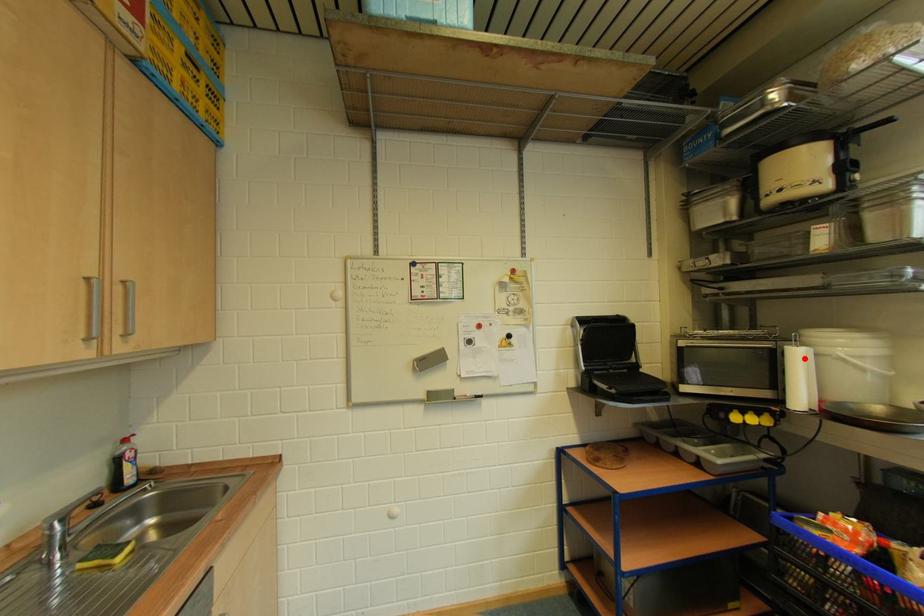
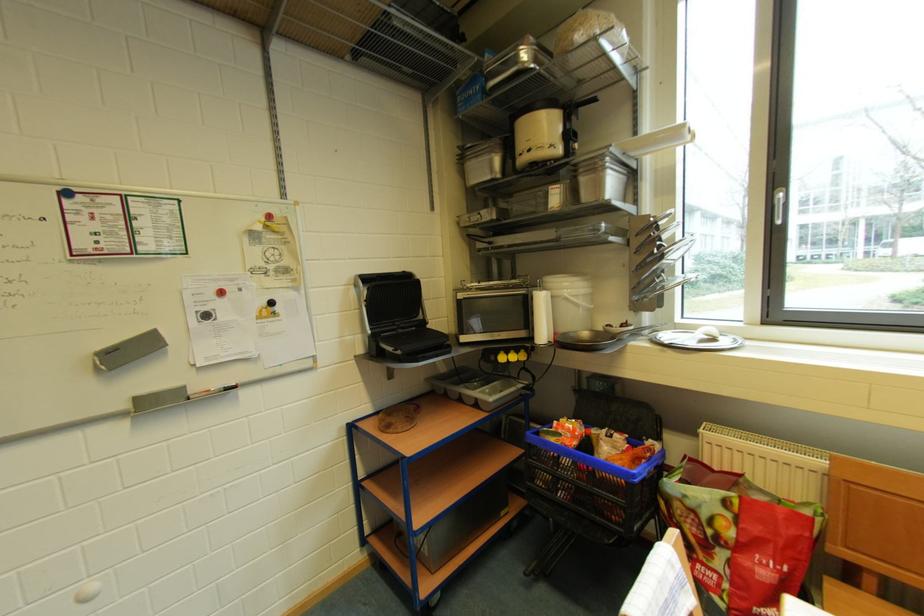
Locate, in the second image, the point that corresponds to the highlighted location in the first image.

(548, 302)